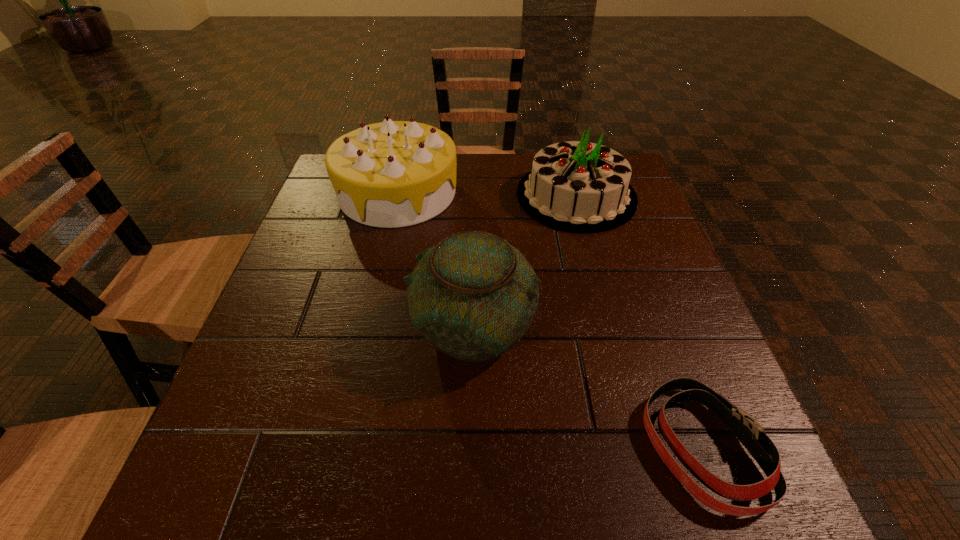
In order to click on object present at the left edge in this screenshot , I will do (391, 174).

Locate an element on the screen. birthday cake positioned at the right edge is located at coordinates (576, 186).

The width and height of the screenshot is (960, 540). What are the coordinates of `dog collar that is at the right edge` in the screenshot? It's located at pos(747,430).

This screenshot has width=960, height=540. I want to click on object that is at the far left corner, so click(391, 174).

Identify the location of object positioned at the far right corner. (576, 186).

You are a GUI agent. You are given a task and a screenshot of the screen. Output one action in this format:
    pyautogui.click(x=<x>, y=<y>)
    Task: Click on the object that is at the near right corner
    The height and width of the screenshot is (540, 960).
    Given the screenshot: What is the action you would take?
    pyautogui.click(x=747, y=430)

Where is `vacant region at the near edge of the desktop`? vacant region at the near edge of the desktop is located at coordinates (469, 511).

Where is `free point at the left edge`? free point at the left edge is located at coordinates (276, 327).

The height and width of the screenshot is (540, 960). Identify the location of blank area at the right edge. click(x=674, y=266).

In the image, there is a desktop. In order to click on free space at the far left corner in this screenshot , I will do [x=322, y=202].